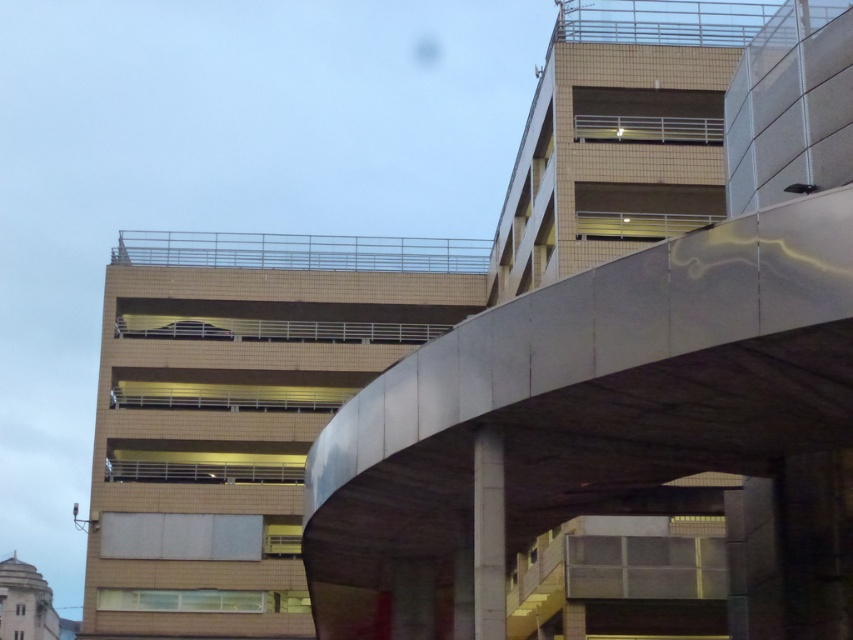
Can you confirm if satin silver overpass at center is positioned above gray concrete pillar at center?

No.

Between satin silver overpass at center and gray concrete pillar at center, which one is positioned higher?

Positioned higher is gray concrete pillar at center.

Is point (521, 420) closer to camera compared to point (503, 528)?

That is False.

Identify the location of satin silver overpass at center. (610, 426).

Between point (386, 326) and point (483, 577), which one is positioned in front?

Positioned in front is point (483, 577).

Is point (267, 234) farther from viewer compared to point (479, 509)?

Yes, point (267, 234) is behind point (479, 509).

Which is behind, point (326, 314) or point (486, 461)?

Positioned behind is point (326, 314).

You are a GUI agent. You are given a task and a screenshot of the screen. Output one action in this format:
    pyautogui.click(x=<x>, y=<y>)
    Task: Click on the beige tile parking garage at center
    The width and height of the screenshot is (853, 640).
    Given the screenshot: What is the action you would take?
    pyautogui.click(x=238, y=410)

Measure the distance between point (701, 438) and camera.

The distance of point (701, 438) from camera is 127.87 feet.

Is satin silver overpass at center positioned at the back of beige tile parking garage at center?

No, it is not.

Who is more distant from viewer, (787, 388) or (268, 324)?

The point (268, 324) is behind.

Image resolution: width=853 pixels, height=640 pixels. I want to click on satin silver overpass at center, so click(x=610, y=426).